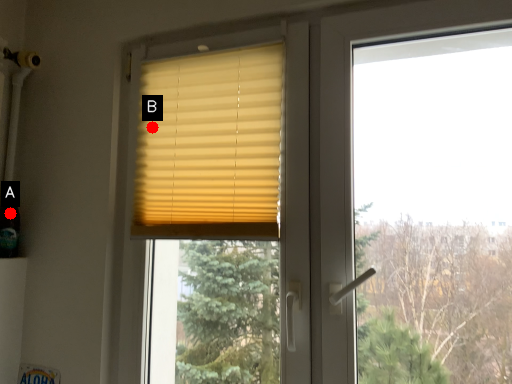
Question: Two points are circled on the image, labeled by A and B beside each circle. Which point is closer to the camera?

Choices:
 (A) A is closer
 (B) B is closer

Answer: (B)